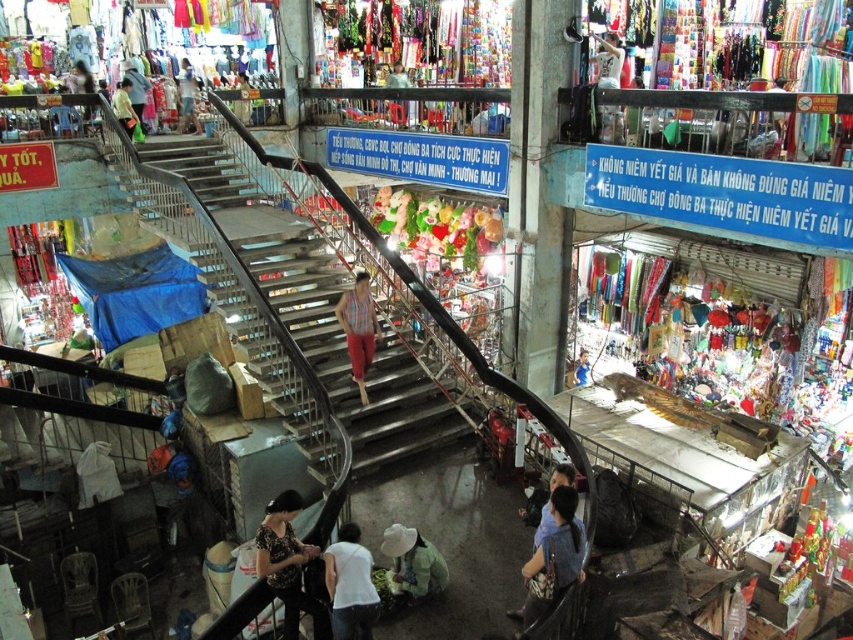
You are a customer in the market looking to buy clothing. You see the dark floral shirt at center and the striped fabric pants at center. Which clothing item is wider?

The dark floral shirt at center is wider than the striped fabric pants at center according to the description.

You are a delivery robot with a height of 1.5 meters. You need to move from the green fabric hat at lower center to the white plastic bag at upper right. Is there enough vertical clearance for you to pass through the space between them?

The distance between the green fabric hat at lower center and the white plastic bag at upper right is 7.59 meters. Since the robot is only 1.5 meters tall, there is sufficient vertical clearance for it to pass through the space between them.